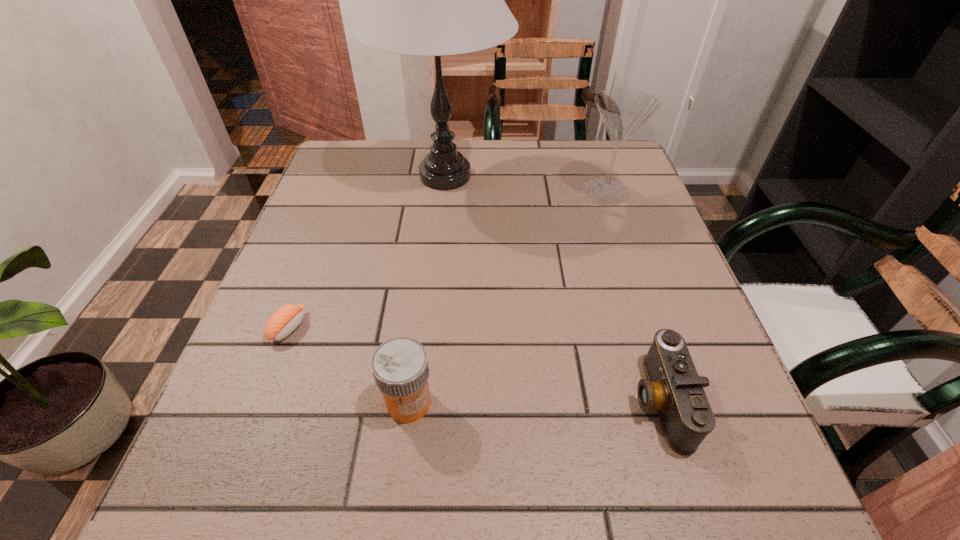
The height and width of the screenshot is (540, 960). In order to click on lamp in this screenshot , I will do `click(435, 0)`.

This screenshot has height=540, width=960. Find the location of `flute glass`. flute glass is located at coordinates (623, 111).

This screenshot has width=960, height=540. Find the location of `medicine`. medicine is located at coordinates (400, 368).

Identify the location of camera. (673, 387).

Where is `the shortest object`? The image size is (960, 540). the shortest object is located at coordinates (284, 321).

Find the location of a particular element. the leftmost object is located at coordinates (284, 321).

This screenshot has height=540, width=960. Identify the location of vacant space situated 0.210m on the right of the tallest object. (592, 176).

Where is `vacant space located on the left of the flute glass`? The width and height of the screenshot is (960, 540). vacant space located on the left of the flute glass is located at coordinates (513, 191).

Locate an element on the screen. free space located 0.050m on the label side of the medicine is located at coordinates (402, 459).

This screenshot has width=960, height=540. Identify the location of blank area located on the lens of the camera. (525, 401).